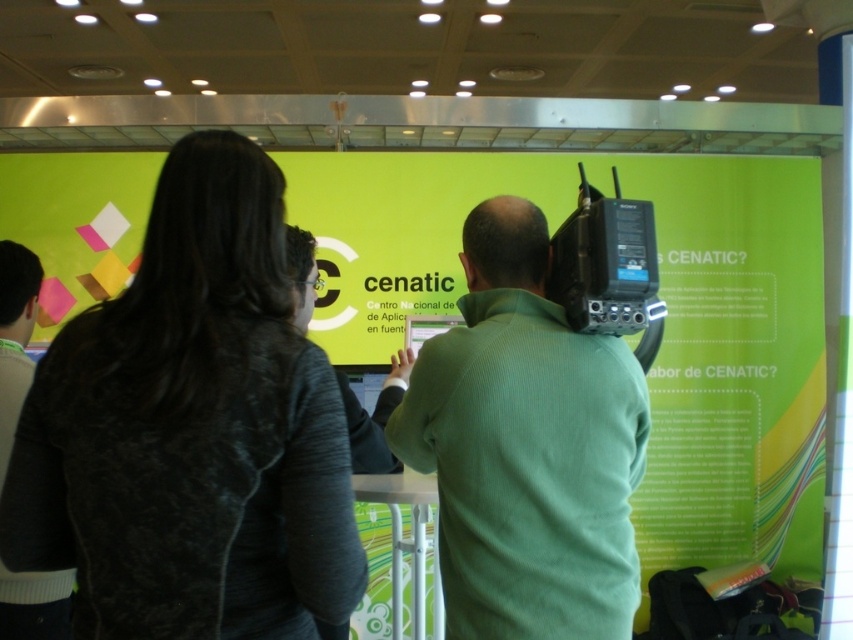
Question: Among these points, which one is nearest to the camera?

Choices:
 (A) (616, 426)
 (B) (392, 404)
 (C) (741, 172)

Answer: (A)

Question: Is green matte poster at center positioned in front of green matte shirt at center?

Choices:
 (A) no
 (B) yes

Answer: (A)

Question: Among these points, which one is nearest to the camera?

Choices:
 (A) (352, 403)
 (B) (22, 595)

Answer: (B)

Question: Among these points, which one is farthest from the camera?

Choices:
 (A) (169, 180)
 (B) (9, 438)
 (C) (639, 394)

Answer: (B)

Question: Can you confirm if green matte poster at center is thinner than green ribbed sweater at center?

Choices:
 (A) no
 (B) yes

Answer: (A)

Question: In this image, where is green matte poster at center located relative to dark gray sweater at left?

Choices:
 (A) left
 (B) right

Answer: (B)